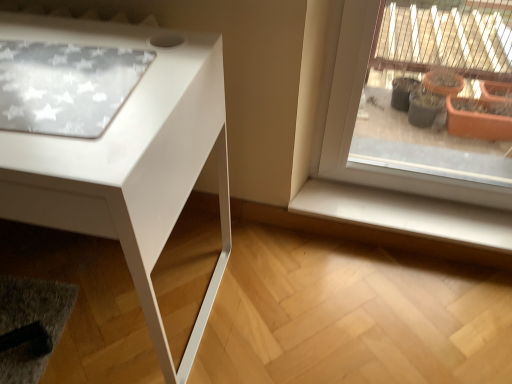
Question: Is white glossy table at left at the left side of white smooth window sill at lower right?

Choices:
 (A) yes
 (B) no

Answer: (A)

Question: Can you confirm if white glossy table at left is thinner than white smooth window sill at lower right?

Choices:
 (A) yes
 (B) no

Answer: (B)

Question: Is white glossy table at left at the right side of white smooth window sill at lower right?

Choices:
 (A) no
 (B) yes

Answer: (A)

Question: From a real-world perspective, does white glossy table at left sit lower than white smooth window sill at lower right?

Choices:
 (A) no
 (B) yes

Answer: (A)

Question: From the image's perspective, is white glossy table at left beneath white smooth window sill at lower right?

Choices:
 (A) no
 (B) yes

Answer: (A)

Question: Considering the relative sizes of white glossy table at left and white smooth window sill at lower right in the image provided, is white glossy table at left shorter than white smooth window sill at lower right?

Choices:
 (A) no
 (B) yes

Answer: (A)

Question: From the image's perspective, is white smooth window sill at lower right located beneath white glossy table at left?

Choices:
 (A) yes
 (B) no

Answer: (A)

Question: Is white smooth window sill at lower right bigger than white glossy table at left?

Choices:
 (A) yes
 (B) no

Answer: (B)

Question: Is white smooth window sill at lower right outside white glossy table at left?

Choices:
 (A) yes
 (B) no

Answer: (A)

Question: Considering the relative sizes of white smooth window sill at lower right and white glossy table at left in the image provided, is white smooth window sill at lower right smaller than white glossy table at left?

Choices:
 (A) no
 (B) yes

Answer: (B)

Question: From a real-world perspective, is white smooth window sill at lower right on top of white glossy table at left?

Choices:
 (A) no
 (B) yes

Answer: (A)

Question: Is white smooth window sill at lower right not near white glossy table at left?

Choices:
 (A) yes
 (B) no

Answer: (B)

Question: From the image's perspective, is white smooth window sill at lower right above or below white glossy table at left?

Choices:
 (A) below
 (B) above

Answer: (A)